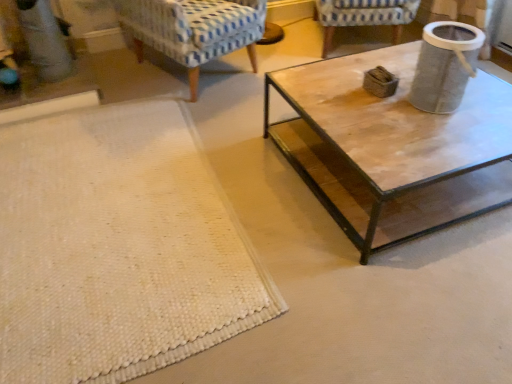
Identify the location of blank area beneath blue patterned fabric chair at upper left, which appears as the first chair when viewed from the left (from a real-world perspective). (183, 76).